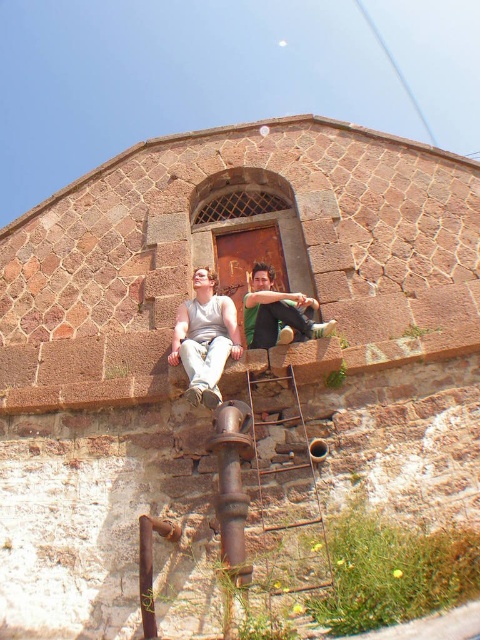
Is matte gray t-shirt at center shorter than green fabric shirt at upper center?

No, matte gray t-shirt at center is not shorter than green fabric shirt at upper center.

How much distance is there between matte gray t-shirt at center and green fabric shirt at upper center?

5.14 feet

Does point (264, 276) come in front of point (283, 323)?

No.

I want to click on matte gray t-shirt at center, so click(x=204, y=339).

Does rusty metal ladder at center appear on the right side of green fabric shirt at upper center?

Incorrect, rusty metal ladder at center is not on the right side of green fabric shirt at upper center.

Is the position of rusty metal ladder at center more distant than that of green fabric shirt at upper center?

No, rusty metal ladder at center is closer to the viewer.

Which is in front, point (286, 404) or point (273, 285)?

Point (286, 404)

Locate an element on the screen. The height and width of the screenshot is (640, 480). rusty metal ladder at center is located at coordinates (287, 490).

Is matte gray t-shirt at center positioned before rusty metal pipe at lower center?

No, it is behind rusty metal pipe at lower center.

Which is more to the right, matte gray t-shirt at center or rusty metal pipe at lower center?

matte gray t-shirt at center is more to the right.

Who is more forward, (241, 348) or (156, 518)?

Positioned in front is point (156, 518).

This screenshot has width=480, height=640. In order to click on matte gray t-shirt at center in this screenshot , I will do `click(204, 339)`.